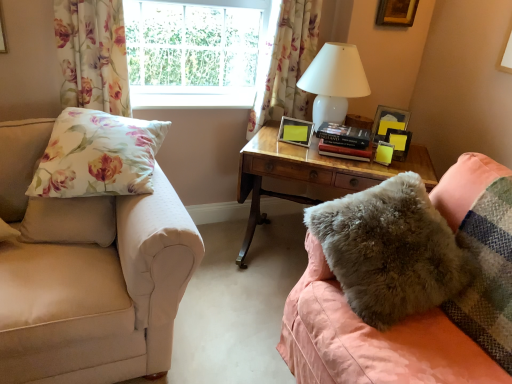
Question: Is matte black picture frame at upper right, which is the 3th picture frame in bottom-to-top order, placed right next to floral fabric curtain at upper center, which is counted as the 1th curtain, starting from the right?

Choices:
 (A) no
 (B) yes

Answer: (A)

Question: Is matte black picture frame at upper right, which is the second picture frame from top to bottom, wider than floral fabric curtain at upper center, which is counted as the 1th curtain, starting from the right?

Choices:
 (A) yes
 (B) no

Answer: (B)

Question: Would you say floral fabric curtain at upper center, the 1th curtain positioned from the back, is part of matte black picture frame at upper right, which is the 3th picture frame in bottom-to-top order,'s contents?

Choices:
 (A) no
 (B) yes

Answer: (A)

Question: Is matte black picture frame at upper right, the 3th picture frame viewed from the left, thinner than floral fabric curtain at upper center, the 2th curtain from the front?

Choices:
 (A) yes
 (B) no

Answer: (A)

Question: From the image's perspective, does matte black picture frame at upper right, the 3th picture frame viewed from the left, appear higher than floral fabric curtain at upper center, which is counted as the 1th curtain, starting from the right?

Choices:
 (A) yes
 (B) no

Answer: (B)

Question: In terms of size, does floral fabric curtain at upper center, which is counted as the second curtain, starting from the left, appear bigger or smaller than floral fabric curtain at upper left, which appears as the first curtain when viewed from the front?

Choices:
 (A) big
 (B) small

Answer: (A)

Question: From their relative heights in the image, would you say floral fabric curtain at upper center, which is counted as the second curtain, starting from the left, is taller or shorter than floral fabric curtain at upper left, the 2th curtain viewed from the back?

Choices:
 (A) short
 (B) tall

Answer: (B)

Question: Considering the positions of point (292, 74) and point (120, 86), is point (292, 74) closer or farther from the camera than point (120, 86)?

Choices:
 (A) closer
 (B) farther

Answer: (B)

Question: Is floral fabric curtain at upper center, the 2th curtain from the front, inside the boundaries of floral fabric curtain at upper left, which is counted as the second curtain, starting from the right, or outside?

Choices:
 (A) outside
 (B) inside

Answer: (A)

Question: Considering the positions of floral fabric pillow at left, the 1th pillow when ordered from left to right, and matte black picture frame at upper right, which is the 3th picture frame in bottom-to-top order, in the image, is floral fabric pillow at left, the 1th pillow when ordered from left to right, wider or thinner than matte black picture frame at upper right, which is the 3th picture frame in bottom-to-top order,?

Choices:
 (A) wide
 (B) thin

Answer: (A)

Question: Which is correct: floral fabric pillow at left, the 1th pillow when ordered from left to right, is inside matte black picture frame at upper right, the 3th picture frame viewed from the left, or outside of it?

Choices:
 (A) inside
 (B) outside

Answer: (B)

Question: In terms of height, does floral fabric pillow at left, the 1th pillow when ordered from left to right, look taller or shorter compared to matte black picture frame at upper right, which is the second picture frame from top to bottom?

Choices:
 (A) short
 (B) tall

Answer: (B)

Question: From a real-world perspective, relative to matte black picture frame at upper right, the 3th picture frame viewed from the left, is floral fabric pillow at left, the 1th pillow when ordered from left to right, vertically above or below?

Choices:
 (A) above
 (B) below

Answer: (B)

Question: Is wooden picture frame at upper right, arranged as the first picture frame when viewed from the right, bigger or smaller than floral fabric pillow at left, placed as the 2th pillow when sorted from right to left?

Choices:
 (A) big
 (B) small

Answer: (B)

Question: From a real-world perspective, is wooden picture frame at upper right, placed as the fourth picture frame when sorted from bottom to top, positioned above or below floral fabric pillow at left, placed as the 2th pillow when sorted from right to left?

Choices:
 (A) below
 (B) above

Answer: (B)